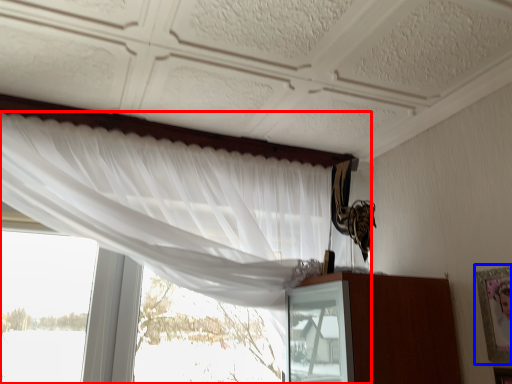
Question: Among these objects, which one is nearest to the camera, curtain (highlighted by a red box) or picture frame (highlighted by a blue box)?

Choices:
 (A) curtain
 (B) picture frame

Answer: (A)